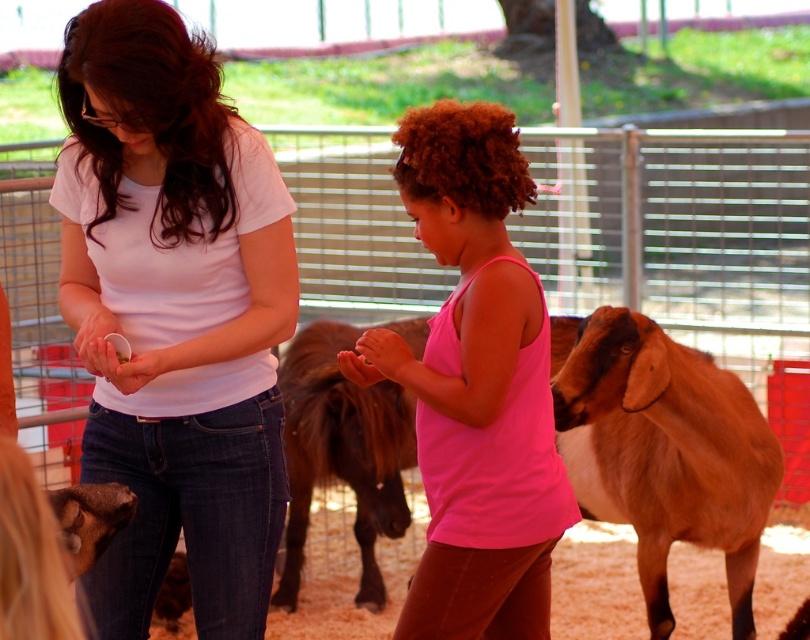
Question: Which of the following is the farthest from the observer?

Choices:
 (A) (595, 397)
 (B) (252, 621)

Answer: (A)

Question: Can you confirm if matte white shirt at center is smaller than brown fuzzy pony at center?

Choices:
 (A) no
 (B) yes

Answer: (B)

Question: Can you confirm if brown woolen goat at right is thinner than brown fuzzy pony at center?

Choices:
 (A) yes
 (B) no

Answer: (B)

Question: Is pink matte tank top at center closer to the viewer compared to brown fuzzy pony at center?

Choices:
 (A) yes
 (B) no

Answer: (A)

Question: Considering the real-world distances, which object is farthest from the matte white shirt at center?

Choices:
 (A) brown woolen goat at right
 (B) brown fuzzy pony at center
 (C) pink matte tank top at center

Answer: (B)

Question: Which of these objects is positioned closest to the pink matte tank top at center?

Choices:
 (A) brown woolen goat at right
 (B) matte white shirt at center
 (C) brown fuzzy pony at center

Answer: (B)